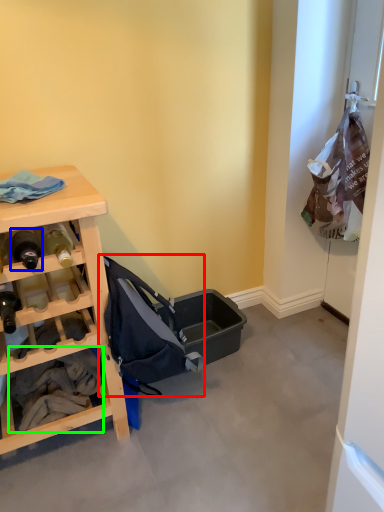
Question: Based on their relative distances, which object is farther from baby carriage (highlighted by a red box)? Choose from bottle (highlighted by a blue box) and clothing (highlighted by a green box).

Choices:
 (A) bottle
 (B) clothing

Answer: (A)